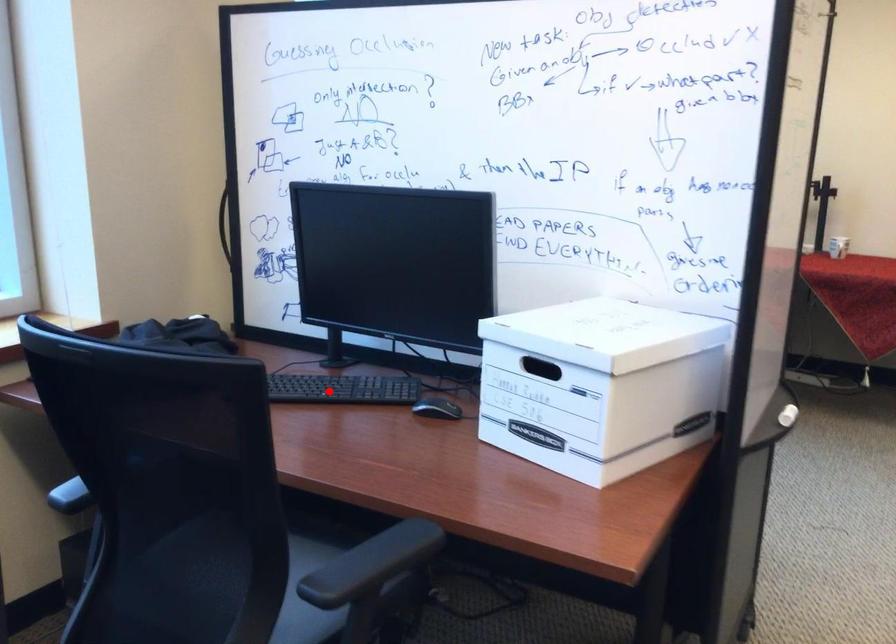
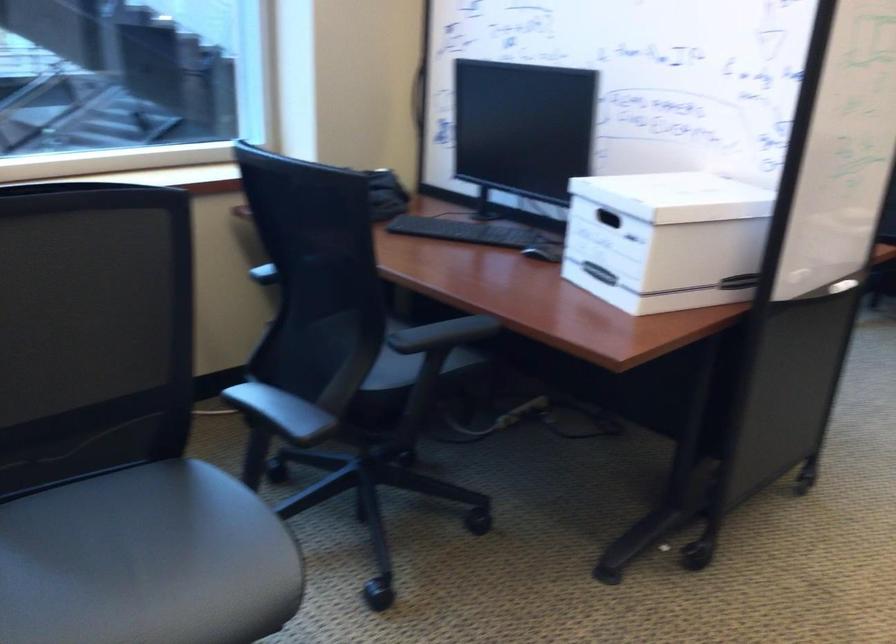
Where in the second image is the point corresponding to the highlighted location from the first image?

(467, 231)